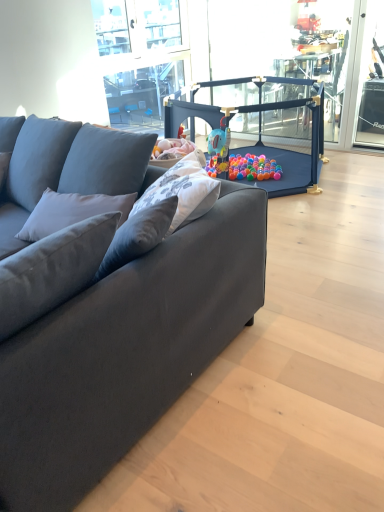
Question: Does matte blue playpen at center have a greater height compared to suede dark gray couch at left?

Choices:
 (A) yes
 (B) no

Answer: (B)

Question: Is matte blue playpen at center far away from suede dark gray couch at left?

Choices:
 (A) yes
 (B) no

Answer: (A)

Question: Is matte blue playpen at center positioned behind suede dark gray couch at left?

Choices:
 (A) yes
 (B) no

Answer: (A)

Question: Is matte blue playpen at center at the right side of suede dark gray couch at left?

Choices:
 (A) yes
 (B) no

Answer: (A)

Question: From a real-world perspective, is matte blue playpen at center located beneath suede dark gray couch at left?

Choices:
 (A) yes
 (B) no

Answer: (A)

Question: Does point (94, 184) appear closer or farther from the camera than point (380, 92)?

Choices:
 (A) farther
 (B) closer

Answer: (B)

Question: From the image's perspective, is suede dark gray couch at left located above or below clear glass window screen at right?

Choices:
 (A) below
 (B) above

Answer: (A)

Question: Is suede dark gray couch at left to the left or to the right of clear glass window screen at right in the image?

Choices:
 (A) left
 (B) right

Answer: (A)

Question: Looking at the image, does suede dark gray couch at left seem bigger or smaller compared to clear glass window screen at right?

Choices:
 (A) small
 (B) big

Answer: (B)

Question: Is suede dark gray couch at left wider or thinner than matte blue playpen at center?

Choices:
 (A) thin
 (B) wide

Answer: (A)

Question: In the image, is suede dark gray couch at left positioned in front of or behind matte blue playpen at center?

Choices:
 (A) front
 (B) behind

Answer: (A)

Question: From a real-world perspective, is suede dark gray couch at left physically located above or below matte blue playpen at center?

Choices:
 (A) above
 (B) below

Answer: (A)

Question: In terms of height, does suede dark gray couch at left look taller or shorter compared to matte blue playpen at center?

Choices:
 (A) tall
 (B) short

Answer: (A)

Question: Looking at their shapes, would you say clear glass window screen at right is wider or thinner than suede dark gray couch at left?

Choices:
 (A) thin
 (B) wide

Answer: (A)

Question: Considering the relative positions of clear glass window screen at right and suede dark gray couch at left in the image provided, is clear glass window screen at right to the left or to the right of suede dark gray couch at left?

Choices:
 (A) right
 (B) left

Answer: (A)